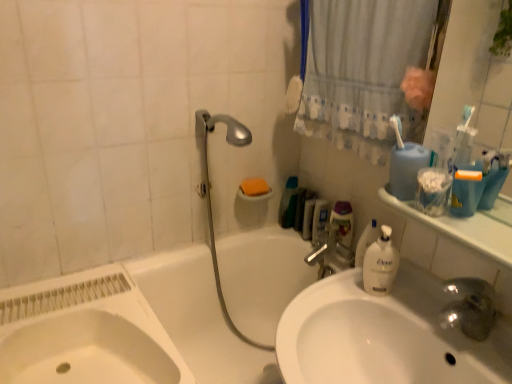
Question: Is white fabric shower curtain at upper right positioned behind silver metallic faucet at upper center?

Choices:
 (A) no
 (B) yes

Answer: (A)

Question: Can we say white fabric shower curtain at upper right lies outside silver metallic faucet at upper center?

Choices:
 (A) yes
 (B) no

Answer: (A)

Question: Does white fabric shower curtain at upper right have a greater height compared to silver metallic faucet at upper center?

Choices:
 (A) yes
 (B) no

Answer: (A)

Question: Considering the relative sizes of white fabric shower curtain at upper right and silver metallic faucet at upper center in the image provided, is white fabric shower curtain at upper right bigger than silver metallic faucet at upper center?

Choices:
 (A) yes
 (B) no

Answer: (A)

Question: From the image's perspective, is white fabric shower curtain at upper right located above silver metallic faucet at upper center?

Choices:
 (A) no
 (B) yes

Answer: (B)

Question: Is blue plastic container at upper right, which is counted as the 2th mouthwash, starting from the right, taller or shorter than white glossy countertop at upper right?

Choices:
 (A) tall
 (B) short

Answer: (A)

Question: Visually, is blue plastic container at upper right, which appears as the 2th mouthwash when viewed from the back, positioned to the left or to the right of white glossy countertop at upper right?

Choices:
 (A) right
 (B) left

Answer: (B)

Question: From the image's perspective, is blue plastic container at upper right, the 2th mouthwash when ordered from front to back, positioned above or below white glossy countertop at upper right?

Choices:
 (A) below
 (B) above

Answer: (B)

Question: Is point coord(408,200) positioned closer to the camera than point coord(498,233)?

Choices:
 (A) farther
 (B) closer

Answer: (A)

Question: Is translucent plastic container at center spatially inside orange sponge at upper right, or outside of it?

Choices:
 (A) outside
 (B) inside

Answer: (A)

Question: In terms of size, does translucent plastic container at center appear bigger or smaller than orange sponge at upper right?

Choices:
 (A) big
 (B) small

Answer: (A)

Question: Considering the positions of translucent plastic container at center and orange sponge at upper right in the image, is translucent plastic container at center taller or shorter than orange sponge at upper right?

Choices:
 (A) tall
 (B) short

Answer: (A)

Question: Does point (335, 218) appear closer or farther from the camera than point (256, 178)?

Choices:
 (A) closer
 (B) farther

Answer: (A)

Question: From a real-world perspective, is translucent plastic bottle at upper right above or below silver metallic shower head at upper center?

Choices:
 (A) above
 (B) below

Answer: (B)

Question: Considering their positions, is translucent plastic bottle at upper right located in front of or behind silver metallic shower head at upper center?

Choices:
 (A) front
 (B) behind

Answer: (B)